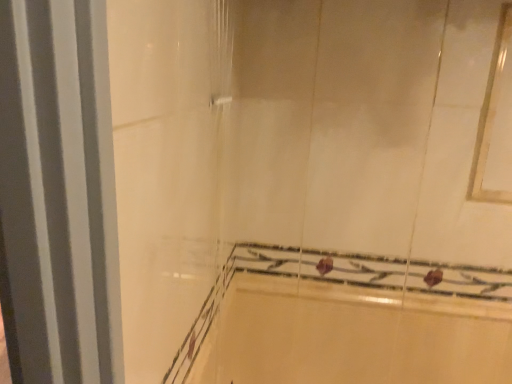
What do you see at coordinates (495, 120) in the screenshot?
I see `white glossy frame at upper right` at bounding box center [495, 120].

What is the approximate height of white glossy frame at upper right?

It is 50.93 centimeters.

In order to face white glossy frame at upper right, should I rotate leftwards or rightwards?

It's best to rotate right around 30.824 degrees.

This screenshot has width=512, height=384. What are the coordinates of `white glossy frame at upper right` in the screenshot? It's located at (495, 120).

You are a GUI agent. You are given a task and a screenshot of the screen. Output one action in this format:
    pyautogui.click(x=<x>, y=<y>)
    Task: Click on the white glossy frame at upper right
    This screenshot has width=512, height=384.
    Given the screenshot: What is the action you would take?
    pyautogui.click(x=495, y=120)